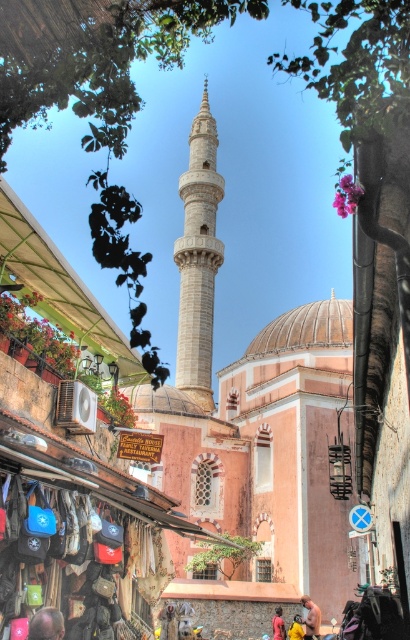
Who is more distant from viewer, (x=312, y=612) or (x=277, y=625)?

Positioned behind is point (x=277, y=625).

What are the coordinates of `beige fabric shirt at center` in the screenshot? It's located at (311, 618).

Where is `beige fabric shirt at center`? beige fabric shirt at center is located at coordinates (311, 618).

Does smooth bald head at center have a greater width compared to dark blue shirt at lower center?

A: Yes.

Locate an element on the screen. This screenshot has width=410, height=640. smooth bald head at center is located at coordinates (47, 625).

The height and width of the screenshot is (640, 410). What do you see at coordinates (47, 625) in the screenshot?
I see `smooth bald head at center` at bounding box center [47, 625].

I want to click on smooth bald head at center, so click(x=47, y=625).

Between smooth bald head at center and beige fabric shirt at center, which one has more height?

smooth bald head at center

Does smooth bald head at center have a greater height compared to beige fabric shirt at center?

Correct, smooth bald head at center is much taller as beige fabric shirt at center.

Is point (54, 637) positioned after point (318, 632)?

No, it is in front of (318, 632).

The image size is (410, 640). I want to click on smooth bald head at center, so click(x=47, y=625).